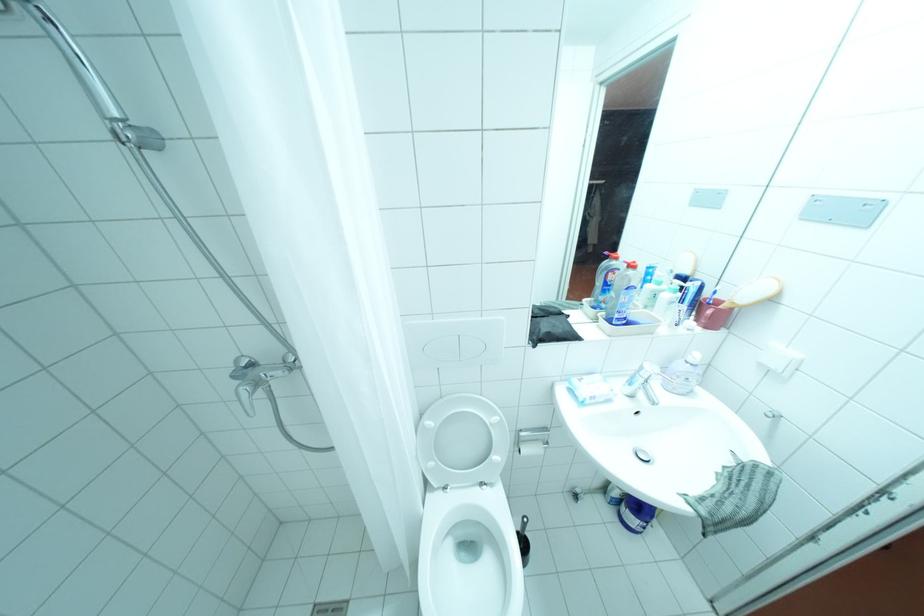
What are the coordinates of `shower faucet handle` in the screenshot? It's located at (246, 382).